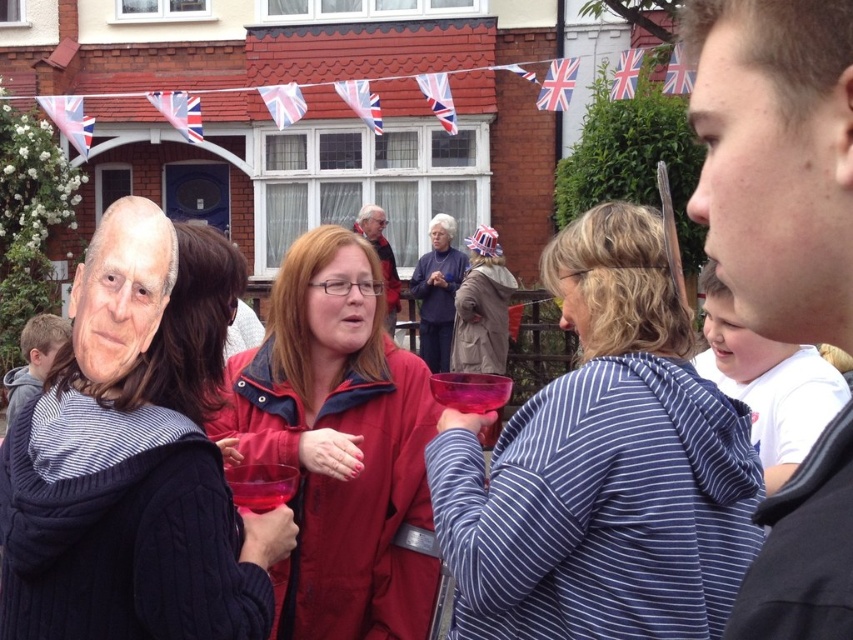
Can you confirm if matte brown coat at center is positioned below matte blue sweater at center?

Correct, matte brown coat at center is located below matte blue sweater at center.

Describe the element at coordinates (482, 307) in the screenshot. This screenshot has height=640, width=853. I see `matte brown coat at center` at that location.

Who is more forward, (497, 371) or (440, 272)?

Point (497, 371)

Where is `matte brown coat at center`? The width and height of the screenshot is (853, 640). matte brown coat at center is located at coordinates (482, 307).

Does red matte jacket at center have a larger size compared to matte brown coat at center?

Yes.

Does point (347, 353) come closer to viewer compared to point (479, 230)?

Yes, it is in front of point (479, 230).

Which is behind, point (312, 392) or point (461, 371)?

Positioned behind is point (461, 371).

The image size is (853, 640). Find the location of `red matte jacket at center`. red matte jacket at center is located at coordinates [x=339, y=445].

Is matte black sweater at center to the left of matte blue sweater at center from the viewer's perspective?

Yes, matte black sweater at center is to the left of matte blue sweater at center.

Which is more to the left, matte black sweater at center or matte blue sweater at center?

Positioned to the left is matte black sweater at center.

Is point (117, 332) less distant than point (445, 344)?

Yes, point (117, 332) is closer to viewer.

Image resolution: width=853 pixels, height=640 pixels. Identify the location of matte black sweater at center. (135, 456).